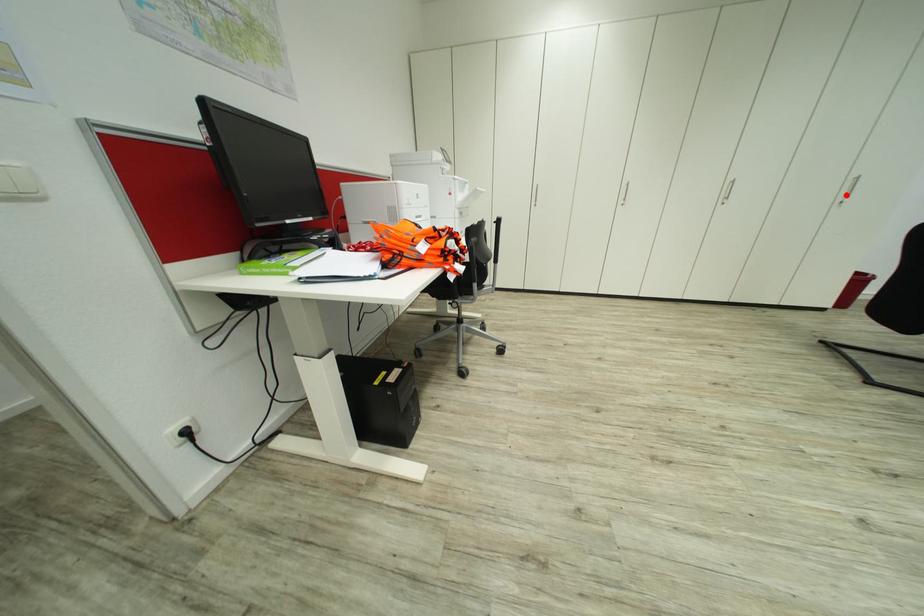
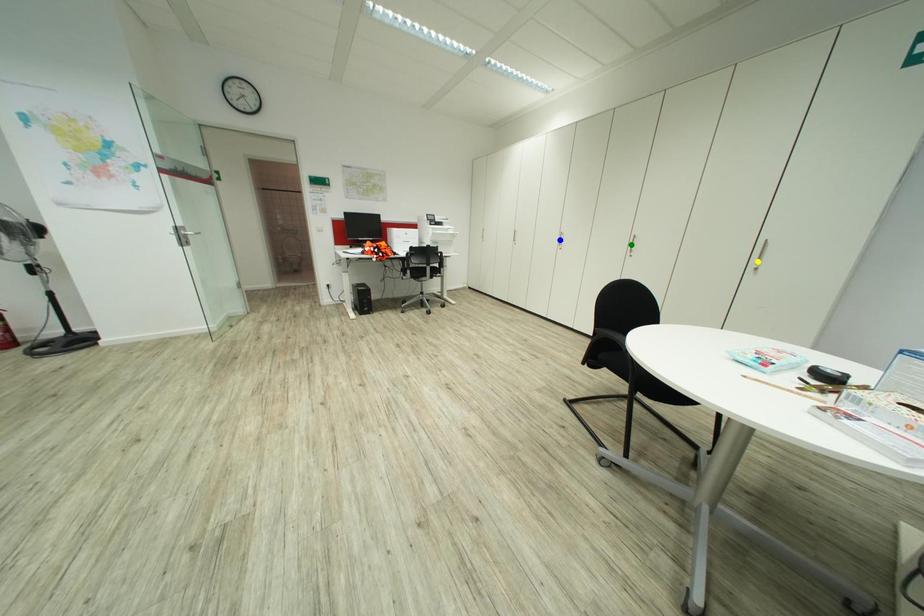
Question: I am providing you with two images of the same scene from different viewpoints. A red point is marked on the first image. You are given multiple points on the second image. Which point in image 2 represents the same 3d spot as the red point in image 1?

Choices:
 (A) blue point
 (B) green point
 (C) yellow point

Answer: (C)